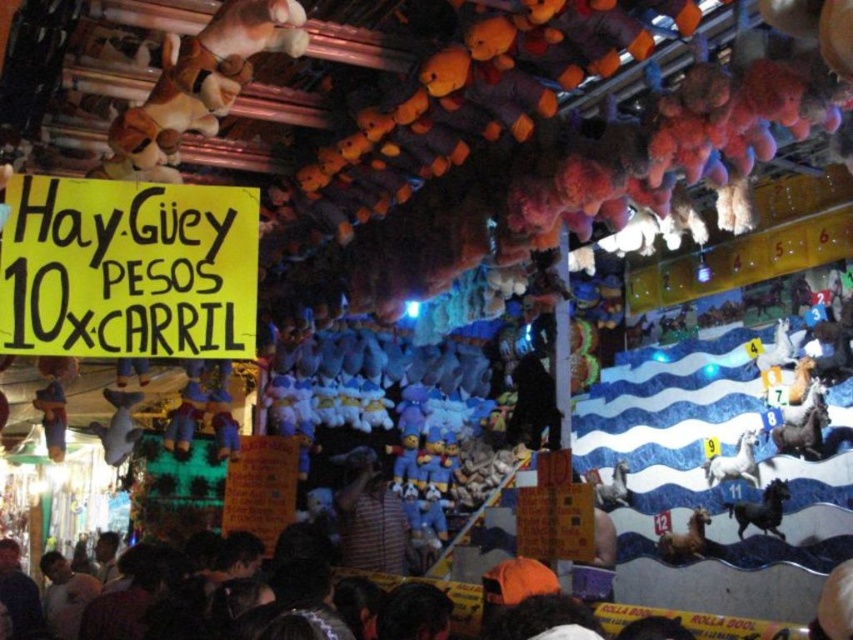
You are at a carnival game where you can win stuffed animals. You see two horses at the lower right corner of the prize wall. The black matte horse at lower right and the brown matte horse at lower right. Which horse do you think you can reach first if you walk straight towards the prize wall?

The brown matte horse at lower right is smaller in width than the black matte horse at lower right, so you can reach the brown matte horse at lower right first as it is closer to you.

From the picture: You are standing in front of the carnival game with stuffed animals hanging above. There are two points marked on the ceiling where the stuffed animals are attached. The first point is at coordinates point (x=758, y=524) and the second point is at coordinates point (x=683, y=536). Which point is closer to you?

Point (x=758, y=524) is closer to the viewer than point (x=683, y=536).

You are standing at the entrance of the carnival game and see the striped shirt at center. The game requires you to throw a ball into a hoop located 5 meters away. Can you reach the hoop from your current position without moving closer?

The distance between you and the striped shirt at center is 5.10 meters, which is slightly more than the required 5 meters to reach the hoop. Therefore, you might need to move a bit closer to ensure you can reach the hoop.